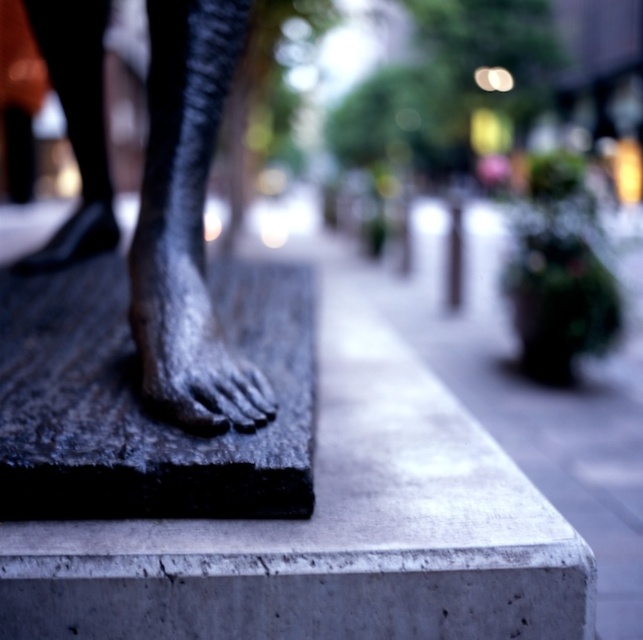
Question: Among these objects, which one is farthest from the camera?

Choices:
 (A) bronze statue foot at center
 (B) black granite slab at center

Answer: (B)

Question: Is bronze statue foot at center positioned behind black granite slab at center?

Choices:
 (A) no
 (B) yes

Answer: (A)

Question: Among these points, which one is nearest to the camera?

Choices:
 (A) (584, 486)
 (B) (156, 148)

Answer: (B)

Question: Does bronze statue foot at center have a larger size compared to black granite slab at center?

Choices:
 (A) yes
 (B) no

Answer: (B)

Question: Is bronze statue foot at center wider than black granite slab at center?

Choices:
 (A) yes
 (B) no

Answer: (B)